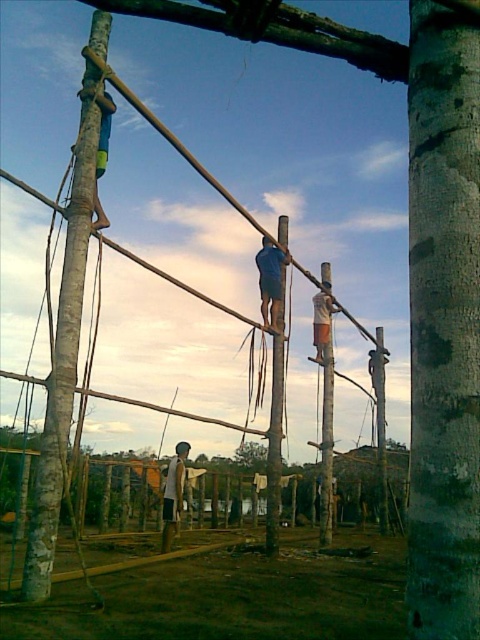
You are a safety inspector evaluating the construction site. You notice two workers at the center of the framework. The blue fabric construction worker at center and the white fabric shirt at center. Based on their clothing, which worker might be more visible to other workers and supervisors? Explain your reasoning.

The blue fabric construction worker at center is more visible because their clothing has a larger width than the white fabric shirt at center, making them stand out more in the construction framework.

Looking at this image, you are a safety inspector at the construction site depicted in the image. You notice two workers, the blue fabric construction worker at center and the white fabric shirt at center. According to safety regulations, workers must maintain a minimum distance of 10 feet apart to prevent accidents. Can you confirm if they are complying with this requirement?

The blue fabric construction worker at center is 11.99 feet away from the white fabric shirt at center. Since 11.99 feet is greater than the required 10 feet, they are complying with the safety regulations.

You are a safety inspector checking the construction site. The safety guidelines require that any two poles in the framework must be at least 3 meters apart to ensure structural stability. Based on the image, are the smooth bamboo pole at center and the light brown wooden pole at center meeting this requirement?

The smooth bamboo pole at center and the light brown wooden pole at center are 3.16 meters apart, which exceeds the minimum requirement of 3 meters, so they meet the safety guidelines.